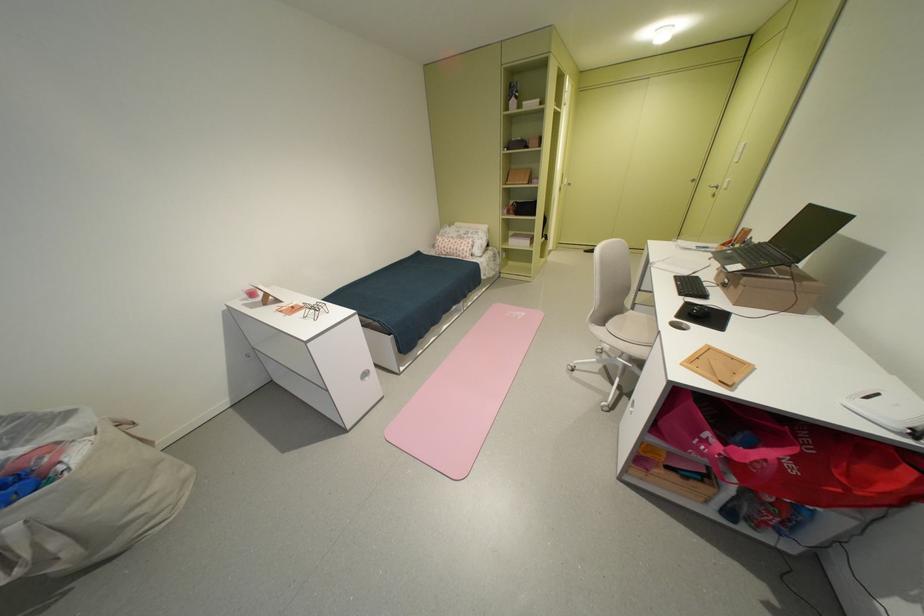
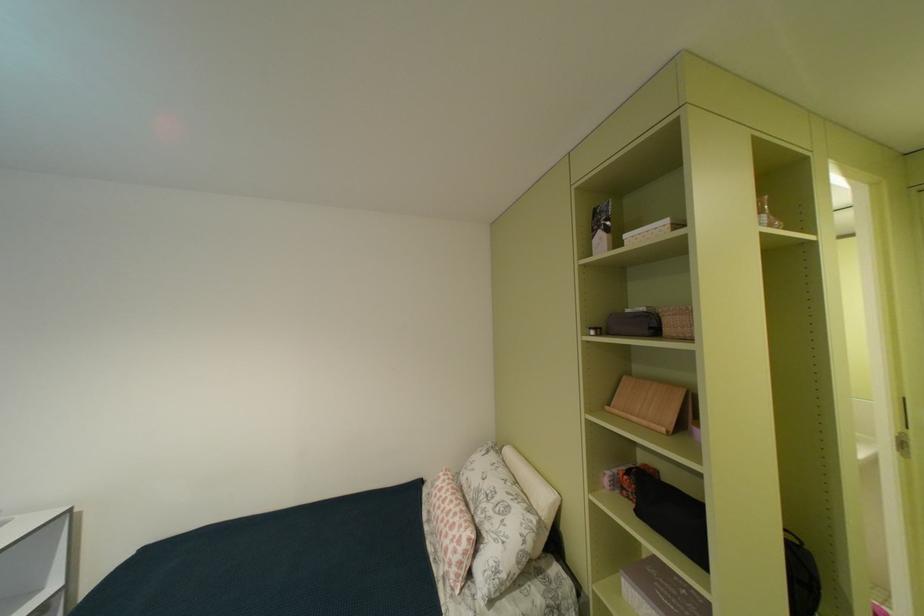
In the second image, find the point that corresponds to point 467,236 in the first image.

(487, 487)